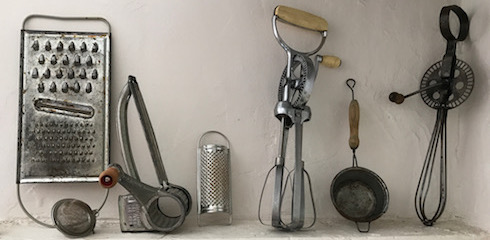
Identify the location of small cooking pot. (360, 198).